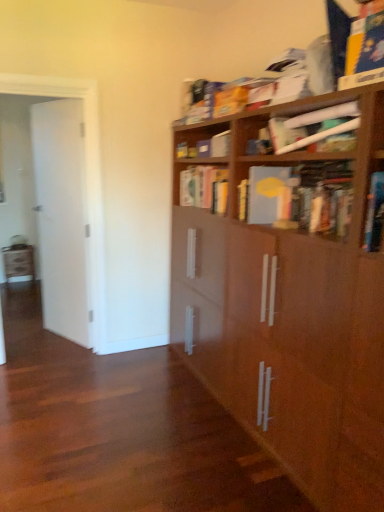
What do you see at coordinates (204, 188) in the screenshot?
I see `yellow matte book at center, the first book in the back-to-front sequence` at bounding box center [204, 188].

What is the approximate width of yellow matte book at center, the first book in the back-to-front sequence?

It is 11.40 inches.

What is the approximate height of matte white paper at upper right, positioned as the 1th book in front-to-back order?

It is 8.40 inches.

Find the location of `matte white paper at upper right, positioned as the 1th book in front-to-back order`. matte white paper at upper right, positioned as the 1th book in front-to-back order is located at coordinates 312,126.

This screenshot has width=384, height=512. Describe the element at coordinates (302, 197) in the screenshot. I see `matte gray book at upper right, acting as the second book starting from the front` at that location.

I want to click on yellow matte book at center, which is counted as the 3th book, starting from the front, so click(204, 188).

Is white glossy door at left bigger or smaller than matte white paper at upper right, positioned as the 1th book in front-to-back order?

Considering their sizes, white glossy door at left takes up more space than matte white paper at upper right, positioned as the 1th book in front-to-back order.

Is white glossy door at left oriented away from matte white paper at upper right, positioned as the 1th book in front-to-back order?

No, white glossy door at left's orientation is not away from matte white paper at upper right, positioned as the 1th book in front-to-back order.

Visually, is white glossy door at left positioned to the left or to the right of matte white paper at upper right, arranged as the third book when viewed from the back?

white glossy door at left is positioned on matte white paper at upper right, arranged as the third book when viewed from the back,'s left side.

Is matte white paper at upper right, positioned as the 1th book in front-to-back order, completely or partially inside white glossy door at left?

That's incorrect, matte white paper at upper right, positioned as the 1th book in front-to-back order, is not inside white glossy door at left.

Based on the photo, in terms of height, does brown wood bookcase at upper right look taller or shorter compared to matte white paper at upper right, arranged as the third book when viewed from the back?

brown wood bookcase at upper right is taller than matte white paper at upper right, arranged as the third book when viewed from the back.

Is brown wood bookcase at upper right at the left side of matte white paper at upper right, arranged as the third book when viewed from the back?

Indeed, brown wood bookcase at upper right is positioned on the left side of matte white paper at upper right, arranged as the third book when viewed from the back.

Is brown wood bookcase at upper right not inside matte white paper at upper right, positioned as the 1th book in front-to-back order?

That's correct, brown wood bookcase at upper right is outside of matte white paper at upper right, positioned as the 1th book in front-to-back order.

I want to click on bookcase that is on the left side of matte white paper at upper right, positioned as the 1th book in front-to-back order, so click(290, 298).

Is matte white paper at upper right, arranged as the third book when viewed from the back, outside of white glossy door at left?

matte white paper at upper right, arranged as the third book when viewed from the back, is positioned outside white glossy door at left.

Does matte white paper at upper right, positioned as the 1th book in front-to-back order, come in front of white glossy door at left?

Yes, matte white paper at upper right, positioned as the 1th book in front-to-back order, is closer to the camera.

Visually, is matte white paper at upper right, positioned as the 1th book in front-to-back order, positioned to the left or to the right of white glossy door at left?

From the image, it's evident that matte white paper at upper right, positioned as the 1th book in front-to-back order, is to the right of white glossy door at left.

In the scene shown: Considering the sizes of objects matte white paper at upper right, arranged as the third book when viewed from the back, and white glossy door at left in the image provided, who is shorter, matte white paper at upper right, arranged as the third book when viewed from the back, or white glossy door at left?

Standing shorter between the two is matte white paper at upper right, arranged as the third book when viewed from the back.

Is matte gray book at upper right, acting as the second book starting from the front, oriented away from matte white paper at upper right, positioned as the 1th book in front-to-back order?

That's not correct — matte gray book at upper right, acting as the second book starting from the front, is not looking away from matte white paper at upper right, positioned as the 1th book in front-to-back order.

Is matte gray book at upper right, acting as the second book starting from the front, far away from matte white paper at upper right, positioned as the 1th book in front-to-back order?

No, there isn't a large distance between matte gray book at upper right, acting as the second book starting from the front, and matte white paper at upper right, positioned as the 1th book in front-to-back order.

Which point is more distant from viewer, (304, 200) or (329, 110)?

The point (304, 200) is farther from the camera.

Can you confirm if matte white paper at upper right, positioned as the 1th book in front-to-back order, is taller than yellow matte book at center, the first book in the back-to-front sequence?

No.

Is matte white paper at upper right, positioned as the 1th book in front-to-back order, further to the viewer compared to yellow matte book at center, the first book in the back-to-front sequence?

No, it is in front of yellow matte book at center, the first book in the back-to-front sequence.

Which is more to the left, matte white paper at upper right, arranged as the third book when viewed from the back, or yellow matte book at center, which is counted as the 3th book, starting from the front?

From the viewer's perspective, yellow matte book at center, which is counted as the 3th book, starting from the front, appears more on the left side.

Is matte white paper at upper right, arranged as the third book when viewed from the back, next to yellow matte book at center, the first book in the back-to-front sequence?

No, matte white paper at upper right, arranged as the third book when viewed from the back, is not touching yellow matte book at center, the first book in the back-to-front sequence.

In terms of height, does yellow matte book at center, the first book in the back-to-front sequence, look taller or shorter compared to matte white paper at upper right, arranged as the third book when viewed from the back?

Clearly, yellow matte book at center, the first book in the back-to-front sequence, is taller compared to matte white paper at upper right, arranged as the third book when viewed from the back.

Considering the sizes of objects yellow matte book at center, which is counted as the 3th book, starting from the front, and matte white paper at upper right, arranged as the third book when viewed from the back, in the image provided, who is bigger, yellow matte book at center, which is counted as the 3th book, starting from the front, or matte white paper at upper right, arranged as the third book when viewed from the back,?

yellow matte book at center, which is counted as the 3th book, starting from the front.

Between yellow matte book at center, which is counted as the 3th book, starting from the front, and matte white paper at upper right, positioned as the 1th book in front-to-back order, which one has smaller width?

matte white paper at upper right, positioned as the 1th book in front-to-back order, is thinner.

Does point (304, 267) come in front of point (315, 226)?

Yes, it is in front of point (315, 226).

From a real-world perspective, relative to matte gray book at upper right, acting as the second book starting from the front, is brown wood bookcase at upper right vertically above or below?

brown wood bookcase at upper right is situated lower than matte gray book at upper right, acting as the second book starting from the front, in the real world.

Where is `bookcase in front of the matte gray book at upper right, acting as the second book starting from the front`? bookcase in front of the matte gray book at upper right, acting as the second book starting from the front is located at coordinates (290, 298).

Is brown wood bookcase at upper right aimed at matte gray book at upper right, arranged as the 2th book when viewed from the back?

Yes, brown wood bookcase at upper right faces towards matte gray book at upper right, arranged as the 2th book when viewed from the back.

At what (x,y) coordinates should I click in order to perform the action: click on door lying below the matte white paper at upper right, arranged as the third book when viewed from the back (from the image's perspective). Please return your answer as a coordinate pair (x, y). Looking at the image, I should click on (62, 218).

You are a GUI agent. You are given a task and a screenshot of the screen. Output one action in this format:
    pyautogui.click(x=<x>, y=<y>)
    Task: Click on the 1st book behind the brown wood bookcase at upper right, starting your count from the anchor
    The height and width of the screenshot is (512, 384).
    Given the screenshot: What is the action you would take?
    pyautogui.click(x=312, y=126)

Estimate the real-world distances between objects in this image. Which object is further from yellow matte book at center, which is counted as the 3th book, starting from the front, brown wood bookcase at upper right or white glossy door at left?

Among the two, white glossy door at left is located further to yellow matte book at center, which is counted as the 3th book, starting from the front.

From the image, which object appears to be nearer to yellow matte book at center, which is counted as the 3th book, starting from the front, white glossy door at left or matte white paper at upper right, arranged as the third book when viewed from the back?

matte white paper at upper right, arranged as the third book when viewed from the back, is closer to yellow matte book at center, which is counted as the 3th book, starting from the front.

Based on their spatial positions, is yellow matte book at center, which is counted as the 3th book, starting from the front, or white glossy door at left further from brown wood bookcase at upper right?

white glossy door at left is positioned further to the anchor brown wood bookcase at upper right.

From the image, which object appears to be nearer to brown wood bookcase at upper right, white glossy door at left or matte white paper at upper right, arranged as the third book when viewed from the back?

matte white paper at upper right, arranged as the third book when viewed from the back, is positioned closer to the anchor brown wood bookcase at upper right.

Estimate the real-world distances between objects in this image. Which object is closer to white glossy door at left, brown wood bookcase at upper right or matte gray book at upper right, arranged as the 2th book when viewed from the back?

brown wood bookcase at upper right is positioned closer to the anchor white glossy door at left.

Looking at the image, which one is located further to matte gray book at upper right, acting as the second book starting from the front, brown wood bookcase at upper right or matte white paper at upper right, arranged as the third book when viewed from the back?

brown wood bookcase at upper right.

From the image, which object appears to be nearer to white glossy door at left, yellow matte book at center, which is counted as the 3th book, starting from the front, or matte white paper at upper right, positioned as the 1th book in front-to-back order?

Among the two, yellow matte book at center, which is counted as the 3th book, starting from the front, is located nearer to white glossy door at left.

When comparing their distances from white glossy door at left, does matte white paper at upper right, positioned as the 1th book in front-to-back order, or yellow matte book at center, which is counted as the 3th book, starting from the front, seem further?

matte white paper at upper right, positioned as the 1th book in front-to-back order, is positioned further to the anchor white glossy door at left.

Where is `book located between white glossy door at left and matte white paper at upper right, arranged as the third book when viewed from the back, in the left-right direction`? This screenshot has width=384, height=512. book located between white glossy door at left and matte white paper at upper right, arranged as the third book when viewed from the back, in the left-right direction is located at coordinates (204, 188).

Find the location of a particular element. book positioned between matte white paper at upper right, arranged as the third book when viewed from the back, and yellow matte book at center, the first book in the back-to-front sequence, from near to far is located at coordinates (302, 197).